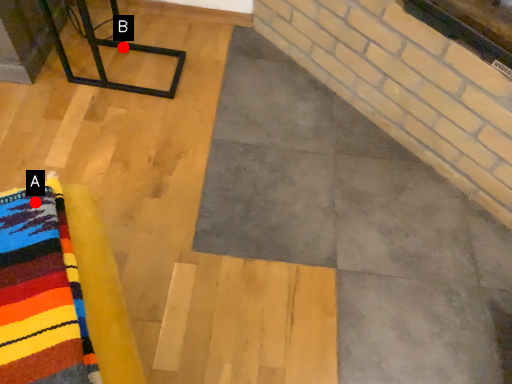
Question: Two points are circled on the image, labeled by A and B beside each circle. Among these points, which one is farthest from the camera?

Choices:
 (A) A is further
 (B) B is further

Answer: (B)